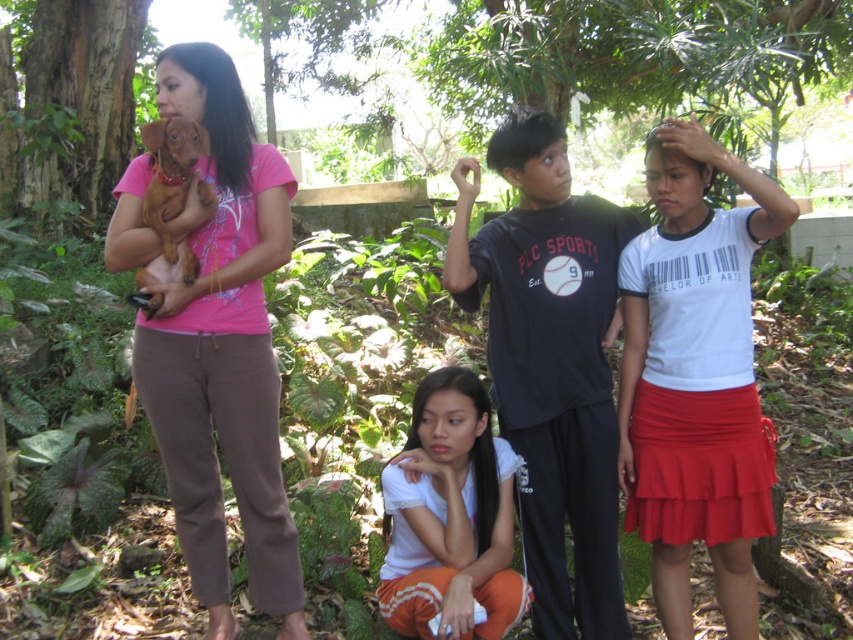
Question: Which point appears farthest from the camera in this image?

Choices:
 (A) (183, 138)
 (B) (694, 516)

Answer: (B)

Question: Which point is farther to the camera?

Choices:
 (A) (619, 467)
 (B) (224, 147)
 (C) (549, 173)

Answer: (A)

Question: Is pink matte shirt at left above black cotton shirt at center?

Choices:
 (A) no
 (B) yes

Answer: (B)

Question: Is pink matte shirt at left to the right of white matte shirt at lower center from the viewer's perspective?

Choices:
 (A) yes
 (B) no

Answer: (B)

Question: Can you confirm if black cotton shirt at center is wider than brown furry dog at left?

Choices:
 (A) yes
 (B) no

Answer: (A)

Question: Which of the following is the farthest from the observer?

Choices:
 (A) (442, 417)
 (B) (538, 611)
 (C) (262, 264)

Answer: (B)